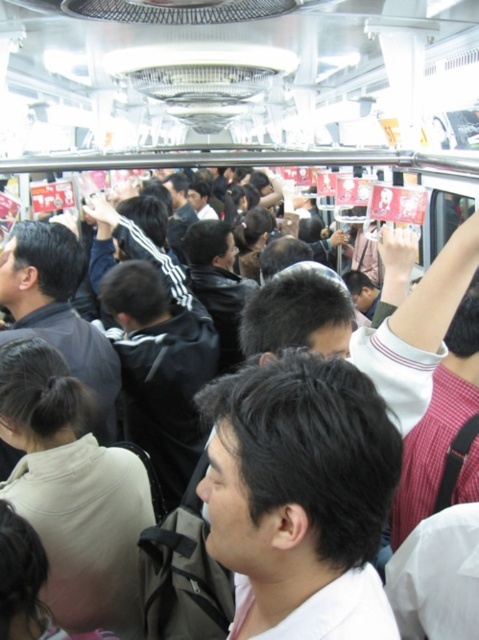
Question: Which of the following is the closest to the observer?

Choices:
 (A) black matte jacket at center
 (B) dark gray jacket at center
 (C) black matte hair at center

Answer: (C)

Question: Is black matte jacket at center behind dark gray jacket at center?

Choices:
 (A) no
 (B) yes

Answer: (B)

Question: Can you confirm if black matte hair at center is positioned below black matte jacket at center?

Choices:
 (A) no
 (B) yes

Answer: (B)

Question: Does black matte jacket at center lie in front of dark gray jacket at center?

Choices:
 (A) yes
 (B) no

Answer: (B)

Question: Which object is the farthest from the black matte hair at center?

Choices:
 (A) dark gray jacket at center
 (B) black matte jacket at center

Answer: (B)

Question: Which object is the closest to the black matte jacket at center?

Choices:
 (A) black matte hair at center
 (B) dark gray jacket at center

Answer: (B)